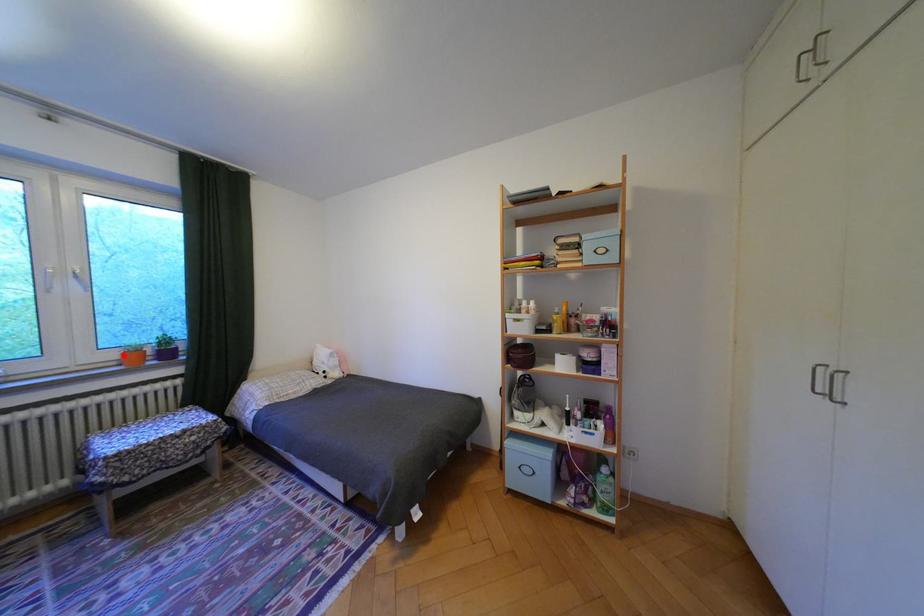
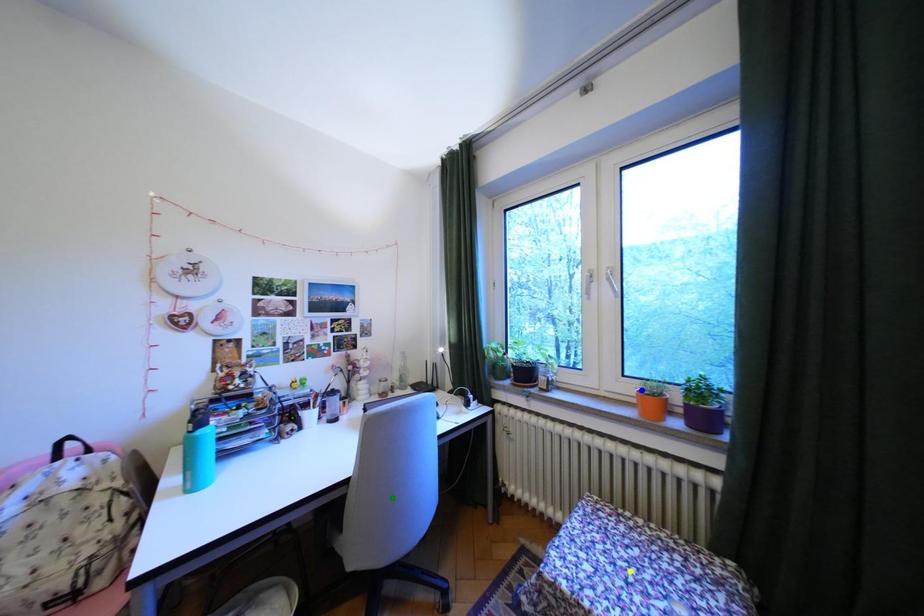
Question: I am providing you with two images of the same scene from different viewpoints. A red point is marked on the first image. You are given multiple points on the second image. Which point in image 2 is actually the same real-world point as the red point in image 1?

Choices:
 (A) blue point
 (B) yellow point
 (C) green point

Answer: (A)